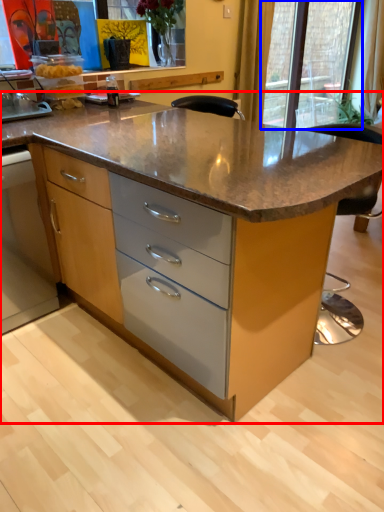
Question: Which object is closer to the camera taking this photo, table (highlighted by a red box) or glass door (highlighted by a blue box)?

Choices:
 (A) table
 (B) glass door

Answer: (A)